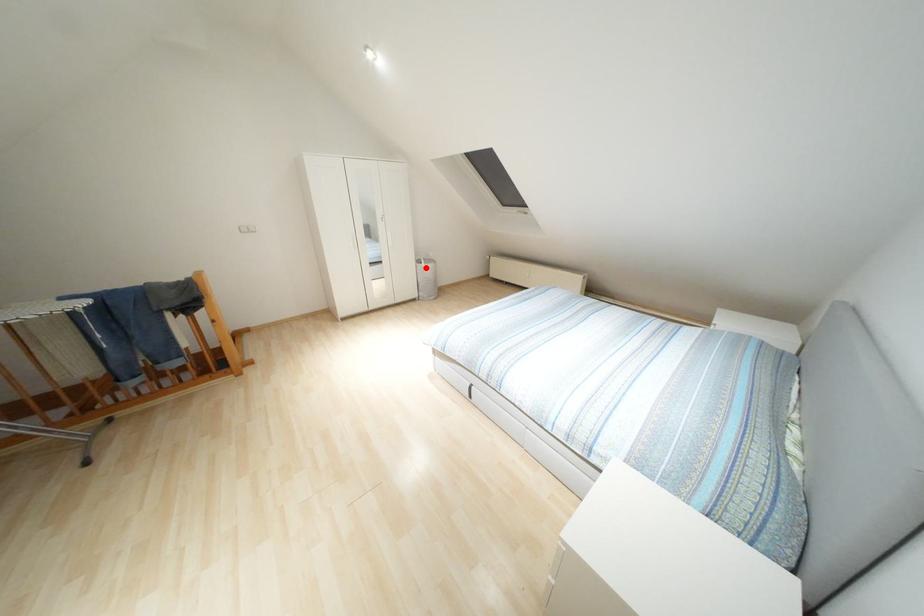
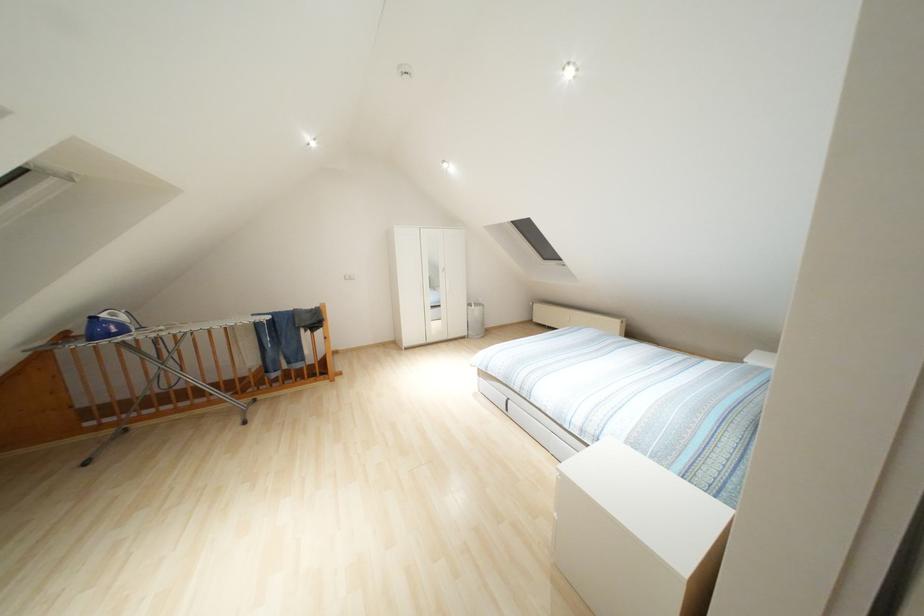
Question: I am providing you with two images of the same scene from different viewpoints. A red point is shown in image1. For the corresponding object point in image2, is it positioned nearer or farther from the camera?

Choices:
 (A) Nearer
 (B) Farther

Answer: (B)